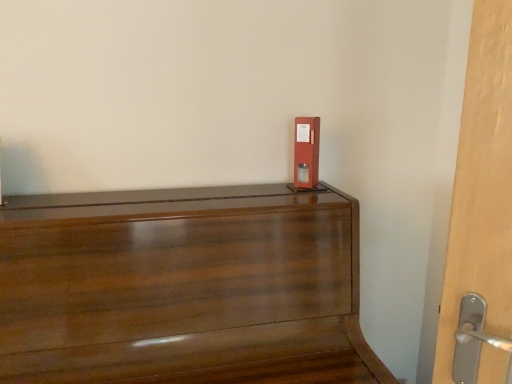
This screenshot has height=384, width=512. What do you see at coordinates (182, 291) in the screenshot? I see `glossy wood piano at upper right` at bounding box center [182, 291].

In order to click on glossy wood piano at upper right in this screenshot , I will do `click(182, 291)`.

Where is `glossy wood piano at upper right`? The width and height of the screenshot is (512, 384). glossy wood piano at upper right is located at coordinates (182, 291).